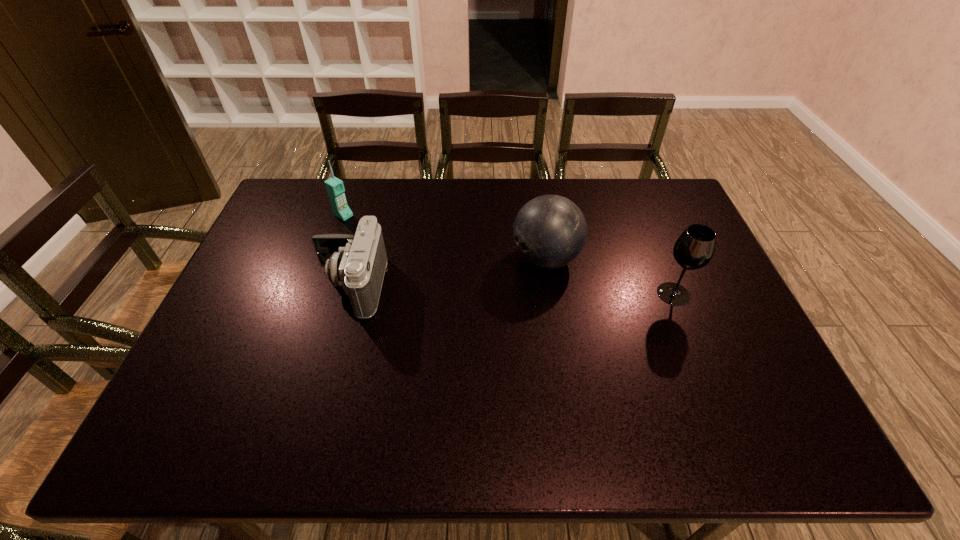
Identify the location of vacant region located on the grip area of the second object from right to left. (494, 281).

The image size is (960, 540). What are the coordinates of `free point located 0.050m on the keypad of the cellular telephone` in the screenshot? It's located at (360, 225).

Find the location of a particular element. This screenshot has height=540, width=960. vacant space located 0.360m on the keypad of the cellular telephone is located at coordinates tap(429, 267).

Locate an element on the screen. blank area located on the keypad of the cellular telephone is located at coordinates (434, 270).

Where is `object present at the far edge`? This screenshot has height=540, width=960. object present at the far edge is located at coordinates (335, 189).

Locate an element on the screen. object that is positioned at the right edge is located at coordinates (694, 249).

In the image, there is a desktop. Identify the location of free space at the far edge. (501, 207).

Identify the location of vacant space at the near edge. (294, 374).

In the image, there is a desktop. Where is `vacant space at the left edge`? Image resolution: width=960 pixels, height=540 pixels. vacant space at the left edge is located at coordinates (253, 249).

In the image, there is a desktop. What are the coordinates of `vacant area at the right edge` in the screenshot? It's located at (712, 274).